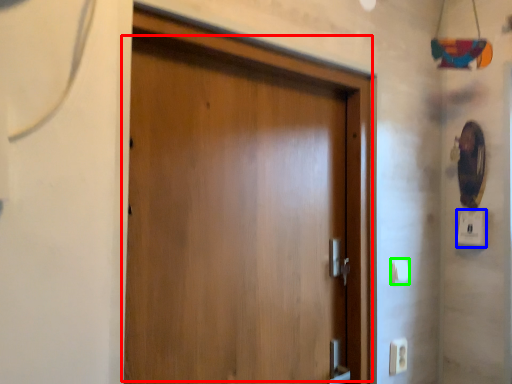
Question: Which is farther away from door (highlighted by a red box)? light switch (highlighted by a blue box) or light switch (highlighted by a green box)?

Choices:
 (A) light switch
 (B) light switch

Answer: (A)